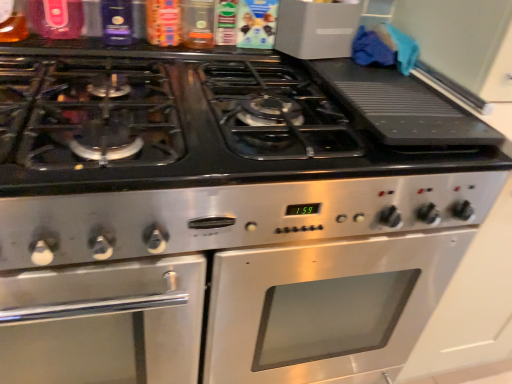
Locate an element on the screen. Image resolution: width=512 pixels, height=384 pixels. stainless steel oven at center is located at coordinates (240, 275).

Measure the distance between stainless steel oven at center and camera.

The distance of stainless steel oven at center from camera is 55.91 centimeters.

This screenshot has width=512, height=384. What do you see at coordinates (240, 275) in the screenshot? I see `stainless steel oven at center` at bounding box center [240, 275].

Describe the element at coordinates (191, 128) in the screenshot. I see `stainless steel gas stove at center` at that location.

What is the approximate width of stainless steel gas stove at center?

The width of stainless steel gas stove at center is 21.55 inches.

Where is `stainless steel gas stove at center`? The width and height of the screenshot is (512, 384). stainless steel gas stove at center is located at coordinates (191, 128).

Where is `stainless steel oven at center`? Image resolution: width=512 pixels, height=384 pixels. stainless steel oven at center is located at coordinates (240, 275).

Is stainless steel gas stove at center at the left side of stainless steel oven at center?

In fact, stainless steel gas stove at center is to the right of stainless steel oven at center.

In the image, is stainless steel gas stove at center positioned in front of or behind stainless steel oven at center?

stainless steel gas stove at center is in front of stainless steel oven at center.

Which point is more distant from viewer, (291, 143) or (157, 201)?

The point (291, 143) is more distant.

From the image's perspective, is stainless steel gas stove at center below stainless steel oven at center?

No.

From the picture: From a real-world perspective, is stainless steel gas stove at center physically above stainless steel oven at center?

Correct, in the physical world, stainless steel gas stove at center is higher than stainless steel oven at center.

Between stainless steel gas stove at center and stainless steel oven at center, which one has larger width?

Wider between the two is stainless steel gas stove at center.

Does stainless steel gas stove at center have a lesser height compared to stainless steel oven at center?

Yes.

Based on the photo, considering the sizes of stainless steel gas stove at center and stainless steel oven at center in the image, is stainless steel gas stove at center bigger or smaller than stainless steel oven at center?

Clearly, stainless steel gas stove at center is smaller in size than stainless steel oven at center.

Is stainless steel gas stove at center inside the boundaries of stainless steel oven at center, or outside?

The correct answer is: outside.

Would you consider stainless steel gas stove at center to be distant from stainless steel oven at center?

Actually, stainless steel gas stove at center and stainless steel oven at center are a little close together.

Is stainless steel gas stove at center positioned with its back to stainless steel oven at center?

No, stainless steel gas stove at center is not facing away from stainless steel oven at center.

How different are the orientations of stainless steel gas stove at center and stainless steel oven at center in degrees?

1.44e-05 degrees.

Measure the distance between stainless steel gas stove at center and stainless steel oven at center.

9.48 inches.

This screenshot has width=512, height=384. In the image, there is a stainless steel oven at center. In order to click on gas stove above it (from the image's perspective) in this screenshot , I will do `click(191, 128)`.

Does stainless steel oven at center appear on the left side of stainless steel gas stove at center?

Indeed, stainless steel oven at center is positioned on the left side of stainless steel gas stove at center.

Is stainless steel oven at center positioned before stainless steel gas stove at center?

No, it is behind stainless steel gas stove at center.

Which is behind, point (393, 238) or point (197, 153)?

The point (393, 238) is more distant.

From the image's perspective, is stainless steel oven at center located above or below stainless steel gas stove at center?

Based on their image positions, stainless steel oven at center is located beneath stainless steel gas stove at center.

From a real-world perspective, is stainless steel oven at center physically above stainless steel gas stove at center?

Incorrect, from a real-world perspective, stainless steel oven at center is lower than stainless steel gas stove at center.

Considering the sizes of objects stainless steel oven at center and stainless steel gas stove at center in the image provided, who is thinner, stainless steel oven at center or stainless steel gas stove at center?

With smaller width is stainless steel oven at center.

Between stainless steel oven at center and stainless steel gas stove at center, which one has less height?

stainless steel gas stove at center.

Considering the sizes of stainless steel oven at center and stainless steel gas stove at center in the image, is stainless steel oven at center bigger or smaller than stainless steel gas stove at center?

Clearly, stainless steel oven at center is larger in size than stainless steel gas stove at center.

Is stainless steel oven at center spatially inside stainless steel gas stove at center, or outside of it?

stainless steel oven at center cannot be found inside stainless steel gas stove at center.

Looking at this image, are stainless steel oven at center and stainless steel gas stove at center making contact?

There is a gap between stainless steel oven at center and stainless steel gas stove at center.

Is stainless steel oven at center aimed at stainless steel gas stove at center?

No, stainless steel oven at center does not turn towards stainless steel gas stove at center.

How many degrees apart are the facing directions of stainless steel oven at center and stainless steel gas stove at center?

1.44e-05 degrees separate the facing orientations of stainless steel oven at center and stainless steel gas stove at center.

Where is `gas stove above the stainless steel oven at center (from the image's perspective)`? This screenshot has width=512, height=384. gas stove above the stainless steel oven at center (from the image's perspective) is located at coordinates (191, 128).

You are a GUI agent. You are given a task and a screenshot of the screen. Output one action in this format:
    pyautogui.click(x=<x>, y=<y>)
    Task: Click on the gas stove positioned vertically above the stainless steel oven at center (from a real-world perspective)
    The height and width of the screenshot is (384, 512).
    Given the screenshot: What is the action you would take?
    pyautogui.click(x=191, y=128)

Where is `oven on the left of stainless steel gas stove at center`? This screenshot has width=512, height=384. oven on the left of stainless steel gas stove at center is located at coordinates (240, 275).